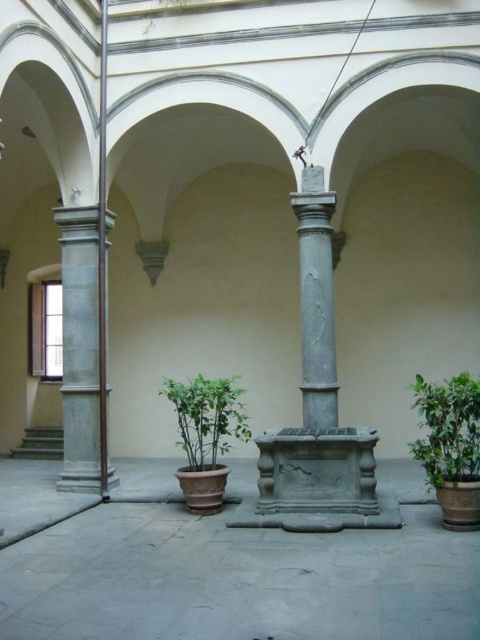
Question: Considering the relative positions of green leafy plant at lower right and green matte pot at center in the image provided, where is green leafy plant at lower right located with respect to green matte pot at center?

Choices:
 (A) right
 (B) left

Answer: (A)

Question: Which point appears closest to the camera in this image?

Choices:
 (A) (204, 419)
 (B) (468, 374)
 (C) (328, 394)
 (D) (87, 438)

Answer: (A)

Question: Does gray stone column at left appear on the right side of green matte pot at center?

Choices:
 (A) no
 (B) yes

Answer: (A)

Question: Which is nearer to the gray stone column at left?

Choices:
 (A) green matte pot at center
 (B) gray stone column at center

Answer: (A)

Question: Which of these objects is positioned closest to the green leafy plant at lower right?

Choices:
 (A) gray stone column at left
 (B) green matte pot at center
 (C) gray stone column at center

Answer: (C)

Question: Is gray stone column at center positioned before green matte pot at center?

Choices:
 (A) yes
 (B) no

Answer: (B)